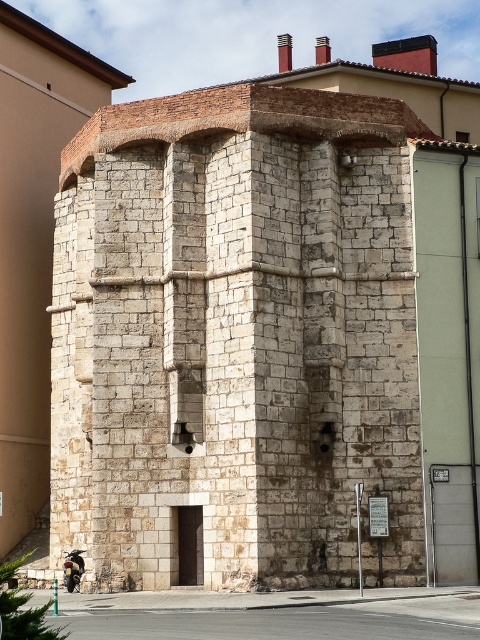
You are a delivery person with a motorcycle that requires a 10 meter minimum distance from any obstacles to safely turn around. You are parked at the shiny chrome motorcycle at lower left. Is there enough space to turn around safely without hitting the white stone tower at center?

The white stone tower at center is 10.18 meters away from the shiny chrome motorcycle at lower left. Since the required minimum distance is 10 meters, the distance is sufficient for a safe turn around without hitting the tower.

In the scene shown: You are a photographer planning to capture a wide shot of the white stone tower at center and the shiny chrome motorcycle at lower left. Based on the scene, which object is wider?

The white stone tower at center is wider than the shiny chrome motorcycle at lower left.

You are standing in front of the historic stone structure. There are two points marked on the building, one at coordinates point [303,266] and the other at point [63,564]. Which point is closer to your current position?

Point [303,266] is closer to the camera than point [63,564], so the point at coordinates point [303,266] is closer to your current position.